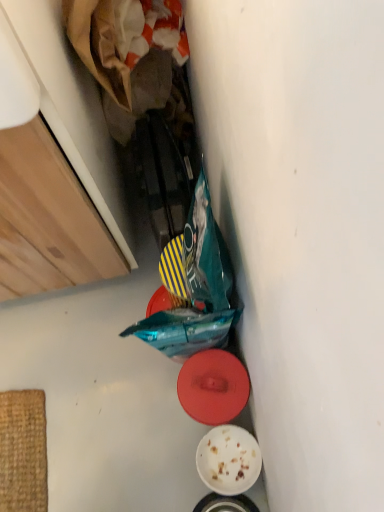
The width and height of the screenshot is (384, 512). Describe the element at coordinates (228, 460) in the screenshot. I see `white matte plate at lower center, the 2th plate viewed from the top` at that location.

Identify the location of white matte plate at lower center, the 2th plate viewed from the top. pyautogui.click(x=228, y=460).

Measure the distance between point (243, 488) and camera.

Point (243, 488) is 33.31 inches away from camera.

In order to face white matte plate at lower center, the 2th plate viewed from the top, should I rotate leftwards or rightwards?

Rotate your view right by about 4.305°.

This screenshot has height=512, width=384. What do you see at coordinates (213, 387) in the screenshot? I see `red matte plate at center, which is the 1th plate in top-to-bottom order` at bounding box center [213, 387].

Where is `red matte plate at center, which is the 1th plate in top-to-bottom order`? This screenshot has width=384, height=512. red matte plate at center, which is the 1th plate in top-to-bottom order is located at coordinates (213, 387).

Image resolution: width=384 pixels, height=512 pixels. I want to click on white matte plate at lower center, which is the first plate from bottom to top, so click(228, 460).

In the image, is red matte plate at center, the second plate ordered from the bottom, on the left side or the right side of white matte plate at lower center, which is the first plate from bottom to top?

Based on their positions, red matte plate at center, the second plate ordered from the bottom, is located to the left of white matte plate at lower center, which is the first plate from bottom to top.

Is red matte plate at center, the second plate ordered from the bottom, positioned in front of white matte plate at lower center, which is the first plate from bottom to top?

That is True.

Between point (221, 377) and point (231, 490), which one is positioned behind?

The point (231, 490) is behind.

From the image's perspective, is red matte plate at center, which is the 1th plate in top-to-bottom order, below white matte plate at lower center, the 2th plate viewed from the top?

No, from the image's perspective, red matte plate at center, which is the 1th plate in top-to-bottom order, is not below white matte plate at lower center, the 2th plate viewed from the top.

From a real-world perspective, who is located lower, red matte plate at center, the second plate ordered from the bottom, or white matte plate at lower center, the 2th plate viewed from the top?

white matte plate at lower center, the 2th plate viewed from the top, from a real-world perspective.

Is red matte plate at center, which is the 1th plate in top-to-bottom order, wider than white matte plate at lower center, which is the first plate from bottom to top?

Yes, red matte plate at center, which is the 1th plate in top-to-bottom order, is wider than white matte plate at lower center, which is the first plate from bottom to top.

Considering the sizes of objects red matte plate at center, the second plate ordered from the bottom, and white matte plate at lower center, the 2th plate viewed from the top, in the image provided, who is shorter, red matte plate at center, the second plate ordered from the bottom, or white matte plate at lower center, the 2th plate viewed from the top,?

With less height is white matte plate at lower center, the 2th plate viewed from the top.

Who is bigger, red matte plate at center, the second plate ordered from the bottom, or white matte plate at lower center, which is the first plate from bottom to top?

red matte plate at center, the second plate ordered from the bottom.

Which is correct: red matte plate at center, the second plate ordered from the bottom, is inside white matte plate at lower center, which is the first plate from bottom to top, or outside of it?

red matte plate at center, the second plate ordered from the bottom, lies outside white matte plate at lower center, which is the first plate from bottom to top.

Is red matte plate at center, the second plate ordered from the bottom, placed right next to white matte plate at lower center, which is the first plate from bottom to top?

No.

Is red matte plate at center, the second plate ordered from the bottom, oriented away from white matte plate at lower center, the 2th plate viewed from the top?

red matte plate at center, the second plate ordered from the bottom, is not turned away from white matte plate at lower center, the 2th plate viewed from the top.

The width and height of the screenshot is (384, 512). I want to click on plate above the white matte plate at lower center, the 2th plate viewed from the top (from the image's perspective), so click(213, 387).

Can you confirm if white matte plate at lower center, which is the first plate from bottom to top, is positioned to the left of red matte plate at center, which is the 1th plate in top-to-bottom order?

Incorrect, white matte plate at lower center, which is the first plate from bottom to top, is not on the left side of red matte plate at center, which is the 1th plate in top-to-bottom order.

Does white matte plate at lower center, which is the first plate from bottom to top, come in front of red matte plate at center, which is the 1th plate in top-to-bottom order?

That is False.

Is point (215, 443) positioned before point (232, 354)?

No, (215, 443) is behind (232, 354).

From the image's perspective, is white matte plate at lower center, which is the first plate from bottom to top, located above red matte plate at center, which is the 1th plate in top-to-bottom order?

No, from the image's perspective, white matte plate at lower center, which is the first plate from bottom to top, is not on top of red matte plate at center, which is the 1th plate in top-to-bottom order.

From a real-world perspective, which is physically below, white matte plate at lower center, the 2th plate viewed from the top, or red matte plate at center, the second plate ordered from the bottom?

A: white matte plate at lower center, the 2th plate viewed from the top, is physically lower.

Which of these two, white matte plate at lower center, the 2th plate viewed from the top, or red matte plate at center, which is the 1th plate in top-to-bottom order, is thinner?

With smaller width is white matte plate at lower center, the 2th plate viewed from the top.

Is white matte plate at lower center, the 2th plate viewed from the top, shorter than red matte plate at center, which is the 1th plate in top-to-bottom order?

Yes, white matte plate at lower center, the 2th plate viewed from the top, is shorter than red matte plate at center, which is the 1th plate in top-to-bottom order.

Which of these two, white matte plate at lower center, which is the first plate from bottom to top, or red matte plate at center, the second plate ordered from the bottom, is smaller?

With smaller size is white matte plate at lower center, which is the first plate from bottom to top.

Choose the correct answer: Is white matte plate at lower center, which is the first plate from bottom to top, inside red matte plate at center, the second plate ordered from the bottom, or outside it?

white matte plate at lower center, which is the first plate from bottom to top, cannot be found inside red matte plate at center, the second plate ordered from the bottom.

Is the surface of white matte plate at lower center, which is the first plate from bottom to top, in direct contact with red matte plate at center, which is the 1th plate in top-to-bottom order?

No, white matte plate at lower center, which is the first plate from bottom to top, is not in contact with red matte plate at center, which is the 1th plate in top-to-bottom order.

Could you tell me if white matte plate at lower center, the 2th plate viewed from the top, is facing red matte plate at center, the second plate ordered from the bottom?

No, white matte plate at lower center, the 2th plate viewed from the top, is not aimed at red matte plate at center, the second plate ordered from the bottom.

What's the angular difference between white matte plate at lower center, which is the first plate from bottom to top, and red matte plate at center, the second plate ordered from the bottom,'s facing directions?

The angle between the facing direction of white matte plate at lower center, which is the first plate from bottom to top, and the facing direction of red matte plate at center, the second plate ordered from the bottom, is 0.000529 degrees.

You are a GUI agent. You are given a task and a screenshot of the screen. Output one action in this format:
    pyautogui.click(x=<x>, y=<y>)
    Task: Click on the plate located underneath the red matte plate at center, the second plate ordered from the bottom (from a real-world perspective)
    The image size is (384, 512).
    Given the screenshot: What is the action you would take?
    pyautogui.click(x=228, y=460)

The height and width of the screenshot is (512, 384). In order to click on plate located on the left of white matte plate at lower center, which is the first plate from bottom to top in this screenshot , I will do `click(213, 387)`.

The height and width of the screenshot is (512, 384). Identify the location of plate on the right of the red matte plate at center, which is the 1th plate in top-to-bottom order. (228, 460).